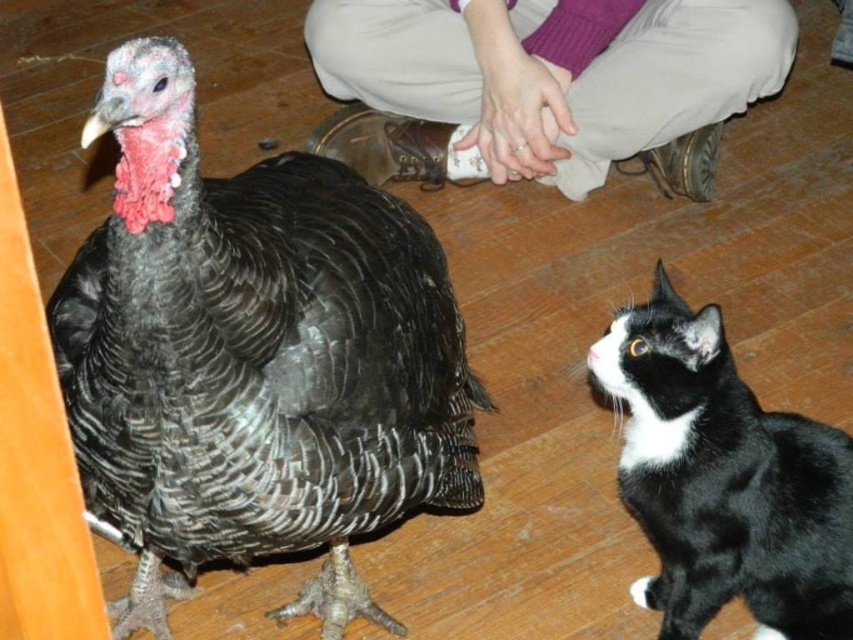
You are a dog trying to decide whether to approach the black textured turkey at center and the beige fabric pants at upper center. Which one is closer to you?

The black textured turkey at center is closer to you because it is in front of the beige fabric pants at upper center.

You are a photographer setting up a shoot in this scene. You want to take a photo where both the black textured turkey at center and the black and white fur cat at lower right are clearly visible. Based on their positions, which animal should you focus on first to ensure both are in focus?

The black textured turkey at center is in front of the black and white fur cat at lower right, so you should focus on the turkey first to ensure both are in focus.

You are a tailor measuring the size of the black textured turkey at center and the beige fabric pants at upper center for a costume. Which object is bigger?

The black textured turkey at center is larger than the beige fabric pants at upper center.